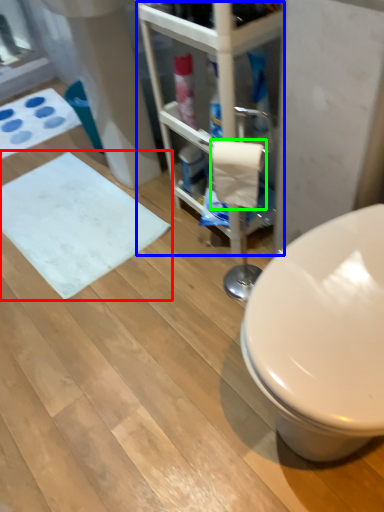
Question: Estimate the real-world distances between objects in this image. Which object is closer to bath mat (highlighted by a red box), shelf (highlighted by a blue box) or toilet paper (highlighted by a green box)?

Choices:
 (A) shelf
 (B) toilet paper

Answer: (A)